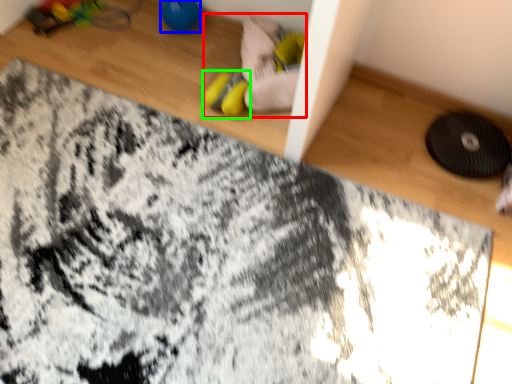
Question: Which object is the closest to the toy (highlighted by a red box)? Choose among these: toy (highlighted by a blue box) or footwear (highlighted by a green box).

Choices:
 (A) toy
 (B) footwear

Answer: (B)